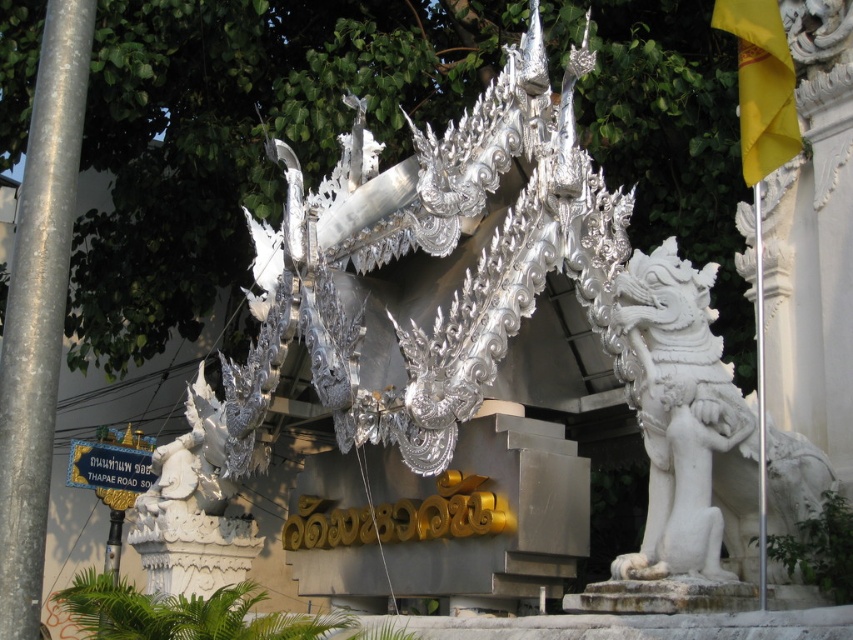
You are a tourist standing in front of the traditional Thai architectural structure. You notice the silver metallic pole at left and the gold metallic street sign at lower left. Which object is larger in size?

The silver metallic pole at left is bigger than the gold metallic street sign at lower left, so the silver metallic pole at left is larger in size.

You are a tourist visiting the temple and want to take a photo of the silver metallic pole at left and the gold metallic street sign at lower left. Which object should you focus on first to ensure both are in the frame without moving the camera?

You should focus on the silver metallic pole at left first because it is closer to you than the gold metallic street sign at lower left, so keeping it in focus will help both appear sharp in the photo.